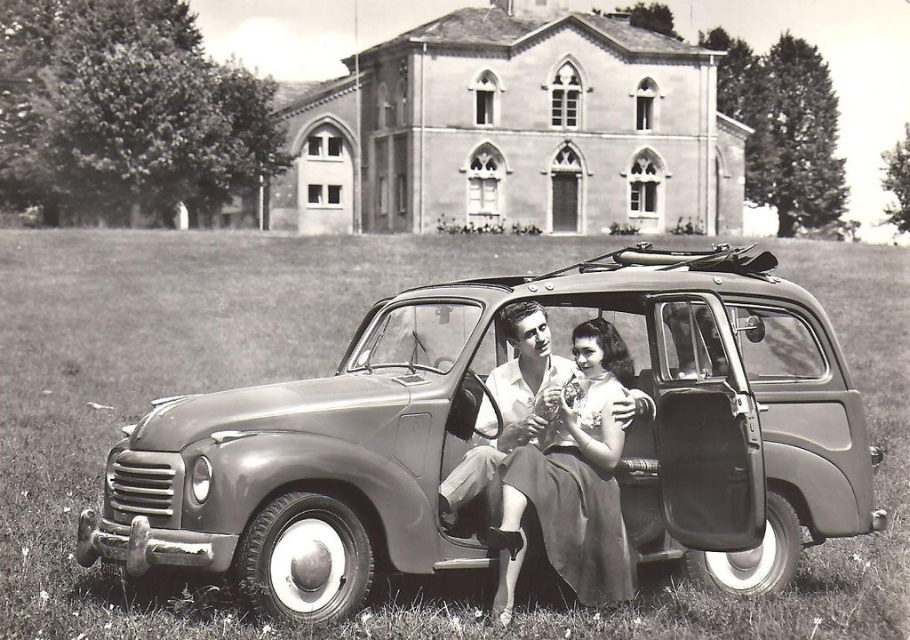
This screenshot has width=910, height=640. Describe the element at coordinates (481, 419) in the screenshot. I see `metallic gray car at center` at that location.

At what (x,y) coordinates should I click in order to perform the action: click on metallic gray car at center. Please return your answer as a coordinate pair (x, y). Looking at the image, I should click on (481, 419).

Is point (817, 307) positioned after point (526, 314)?

Yes, it is.

What are the coordinates of `metallic gray car at center` in the screenshot? It's located at (481, 419).